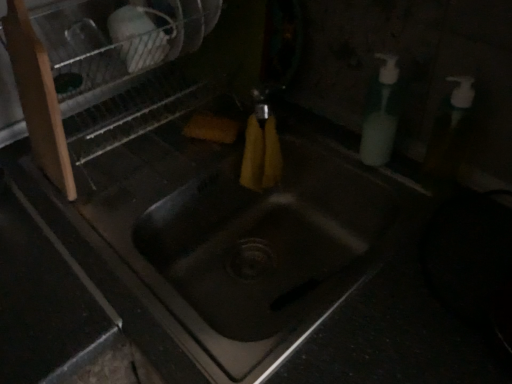
Question: In the image, is white plastic soap dispenser at right on the left side or the right side of metallic silver dish rack at upper left?

Choices:
 (A) left
 (B) right

Answer: (B)

Question: Considering their positions, is white plastic soap dispenser at right located in front of or behind metallic silver dish rack at upper left?

Choices:
 (A) front
 (B) behind

Answer: (B)

Question: From a real-world perspective, is white plastic soap dispenser at right physically located above or below metallic silver dish rack at upper left?

Choices:
 (A) above
 (B) below

Answer: (B)

Question: From the image's perspective, is metallic silver dish rack at upper left positioned above or below white plastic soap dispenser at right?

Choices:
 (A) below
 (B) above

Answer: (B)

Question: In terms of size, does metallic silver dish rack at upper left appear bigger or smaller than white plastic soap dispenser at right?

Choices:
 (A) big
 (B) small

Answer: (A)

Question: In terms of height, does metallic silver dish rack at upper left look taller or shorter compared to white plastic soap dispenser at right?

Choices:
 (A) short
 (B) tall

Answer: (B)

Question: From a real-world perspective, relative to white plastic soap dispenser at right, is metallic silver dish rack at upper left vertically above or below?

Choices:
 (A) above
 (B) below

Answer: (A)